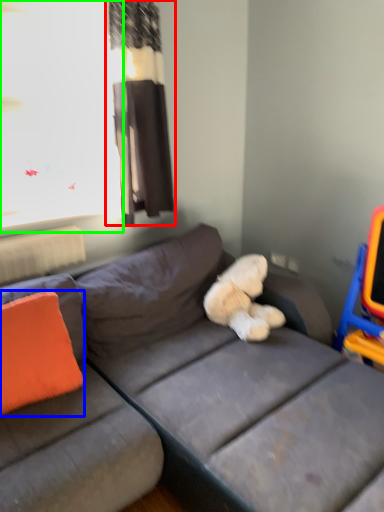
Question: Which object is positioned closest to curtain (highlighted by a red box)? Select from throw pillow (highlighted by a blue box) and window screen (highlighted by a green box).

Choices:
 (A) throw pillow
 (B) window screen

Answer: (B)